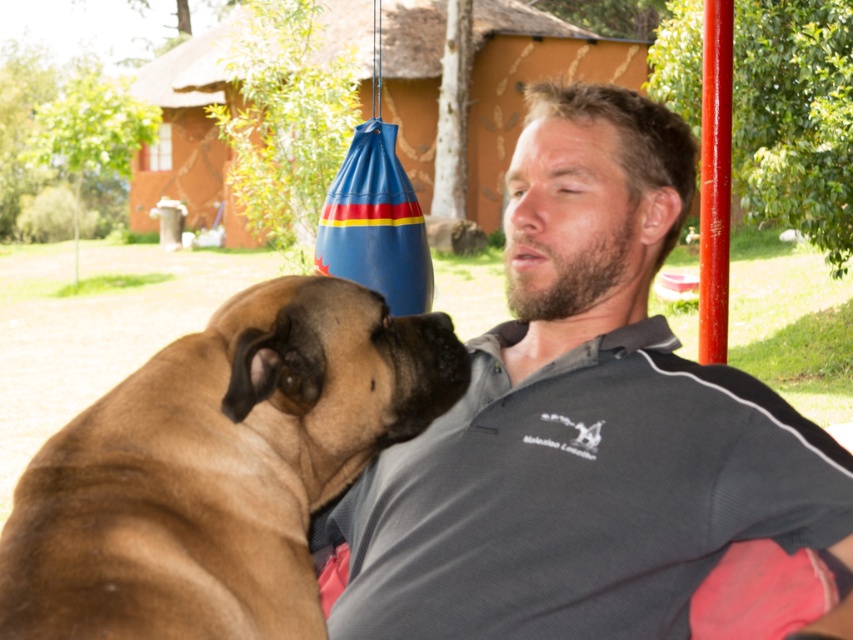
Question: Which object is closer to the camera taking this photo?

Choices:
 (A) gray cotton polo shirt at center
 (B) brown fur dog at left

Answer: (B)

Question: Does gray cotton polo shirt at center appear on the left side of brown fur dog at left?

Choices:
 (A) no
 (B) yes

Answer: (A)

Question: Among these points, which one is nearest to the camera?

Choices:
 (A) (248, 426)
 (B) (834, 524)

Answer: (A)

Question: Is gray cotton polo shirt at center closer to camera compared to brown fur dog at left?

Choices:
 (A) yes
 (B) no

Answer: (B)

Question: Can you confirm if gray cotton polo shirt at center is thinner than brown fur dog at left?

Choices:
 (A) yes
 (B) no

Answer: (B)